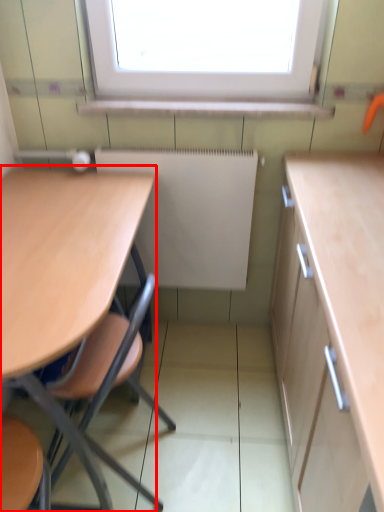
Question: Observing the image, what is the correct spatial positioning of table (annotated by the red box) in reference to radiator?

Choices:
 (A) left
 (B) right

Answer: (A)